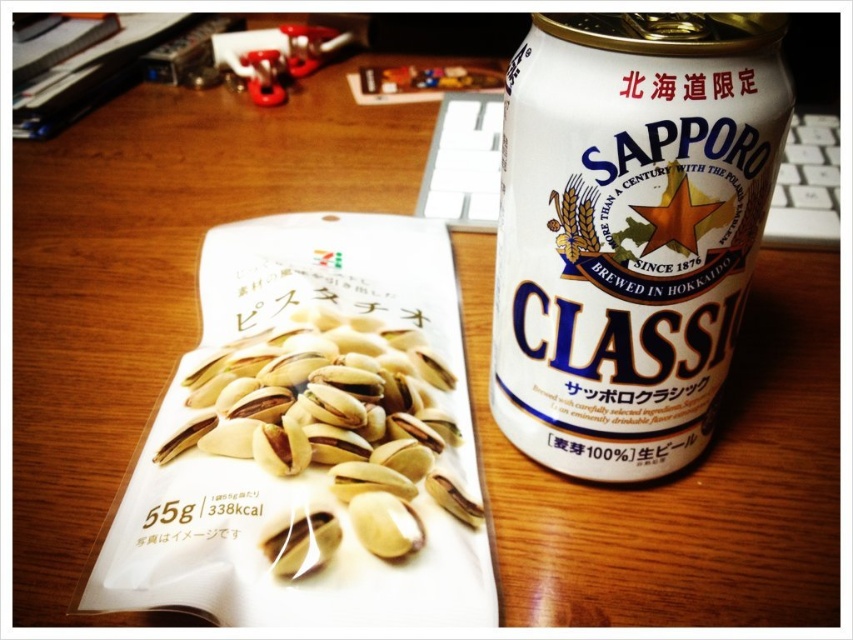
Question: Which point is closer to the camera?

Choices:
 (A) yellow matte pistachios at center
 (B) white matte can at right

Answer: (B)

Question: Can you confirm if white matte can at right is positioned above yellow matte pistachios at center?

Choices:
 (A) yes
 (B) no

Answer: (A)

Question: Which point appears farthest from the camera in this image?

Choices:
 (A) (720, 192)
 (B) (344, 403)

Answer: (B)

Question: Can you confirm if white matte can at right is wider than yellow matte pistachios at center?

Choices:
 (A) no
 (B) yes

Answer: (A)

Question: Does white matte can at right have a lesser width compared to yellow matte pistachios at center?

Choices:
 (A) no
 (B) yes

Answer: (B)

Question: Among these objects, which one is farthest from the camera?

Choices:
 (A) white matte can at right
 (B) yellow matte pistachios at center

Answer: (B)